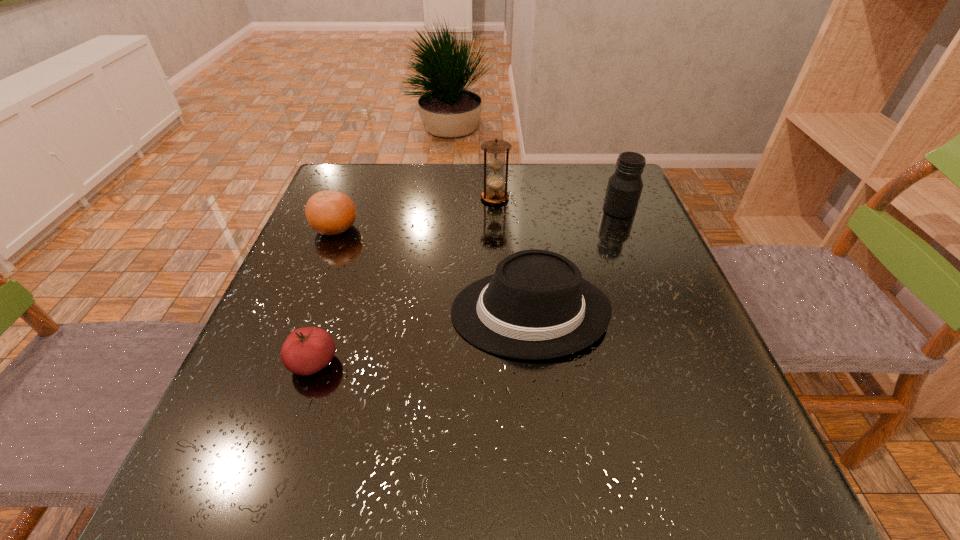
Locate an element on the screen. hourglass is located at coordinates (495, 181).

Image resolution: width=960 pixels, height=540 pixels. Find the location of `jar`. jar is located at coordinates (624, 188).

Locate an element on the screen. This screenshot has width=960, height=540. the third tallest object is located at coordinates point(536,305).

The height and width of the screenshot is (540, 960). What are the coordinates of `clementine` in the screenshot? It's located at point(328,212).

This screenshot has width=960, height=540. I want to click on tomato, so click(307, 350).

You are a GUI agent. You are given a task and a screenshot of the screen. Output one action in this format:
    pyautogui.click(x=<x>, y=<y>)
    Task: Click on the vacant space located 0.370m on the left of the hourglass
    This screenshot has height=540, width=960.
    Given the screenshot: What is the action you would take?
    pyautogui.click(x=344, y=198)

Find the location of a particular element. Image resolution: width=960 pixels, height=540 pixels. vacant space located 0.120m on the front of the jar is located at coordinates (636, 248).

The height and width of the screenshot is (540, 960). What are the coordinates of `free space located 0.290m on the front-facing side of the fedora` in the screenshot? It's located at (307, 312).

Locate an element on the screen. free space located 0.130m on the front-facing side of the fedora is located at coordinates (387, 312).

This screenshot has width=960, height=540. Identify the location of blank space located 0.290m on the front-facing side of the fedora. (307, 312).